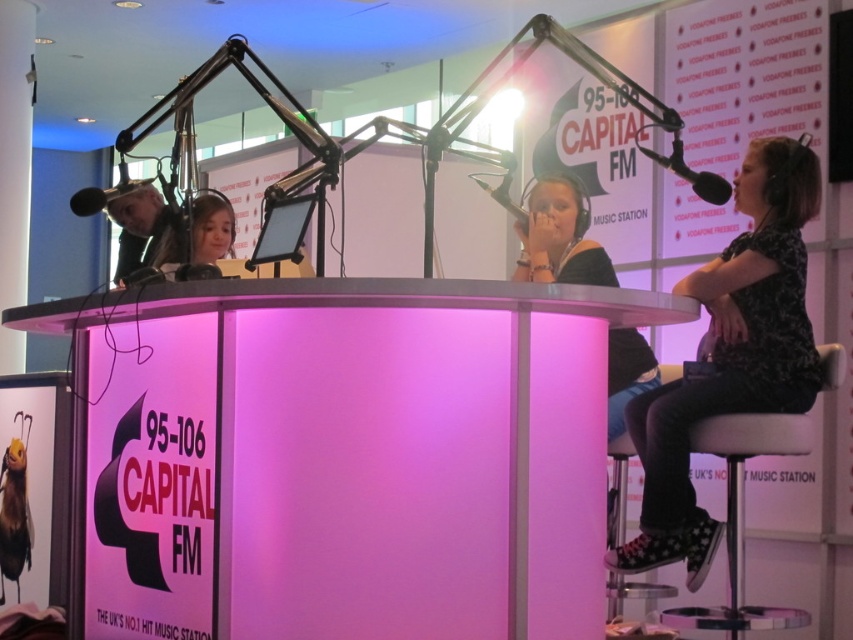
Describe the element at coordinates (730, 355) in the screenshot. I see `floral-patterned shirt at right` at that location.

From the picture: Is floral-patterned shirt at right to the left of matte black shirt at center from the viewer's perspective?

In fact, floral-patterned shirt at right is to the right of matte black shirt at center.

Locate an element on the screen. This screenshot has height=640, width=853. floral-patterned shirt at right is located at coordinates [730, 355].

Is matte black shirt at center above metallic silver microphone at upper center?

No, matte black shirt at center is not above metallic silver microphone at upper center.

Is matte black shirt at center positioned before metallic silver microphone at upper center?

Yes.

Is point (543, 232) in front of point (520, 212)?

Yes.

Find the location of `matte black shirt at center`. matte black shirt at center is located at coordinates (560, 237).

Does black matte microphone at left have a smaller size compared to metallic silver microphone at upper center?

Incorrect, black matte microphone at left is not smaller in size than metallic silver microphone at upper center.

Which is below, black matte microphone at left or metallic silver microphone at upper center?

Positioned lower is black matte microphone at left.

Does point (77, 200) lie in front of point (496, 189)?

Yes.

Image resolution: width=853 pixels, height=640 pixels. I want to click on black matte microphone at left, so click(x=103, y=195).